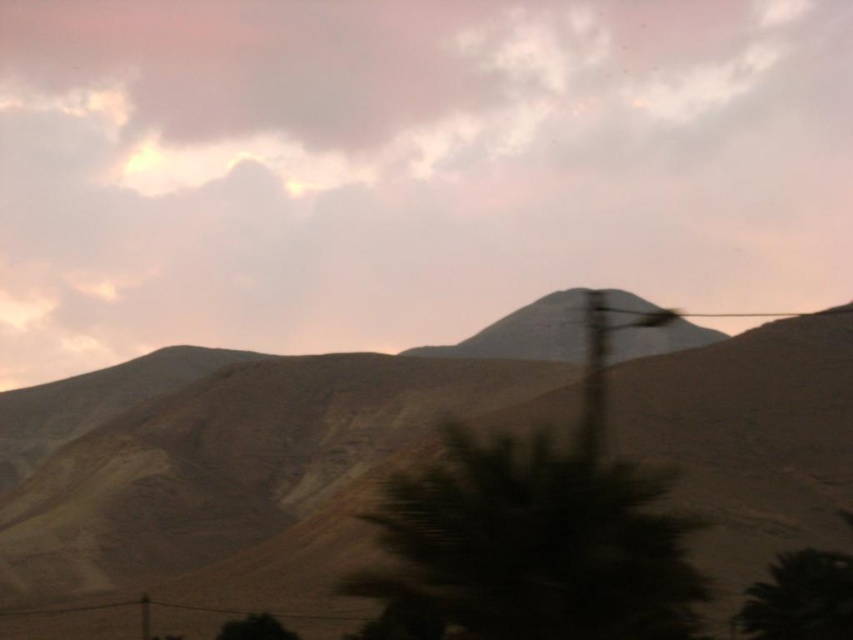
Question: Can you confirm if smokey pink cloud at upper center is positioned above dull brown mountain at center?

Choices:
 (A) no
 (B) yes

Answer: (B)

Question: Is smokey pink cloud at upper center behind dull brown mountain at center?

Choices:
 (A) yes
 (B) no

Answer: (A)

Question: Which object appears farthest from the camera in this image?

Choices:
 (A) smokey pink cloud at upper center
 (B) dull brown mountain at center

Answer: (A)

Question: Is smokey pink cloud at upper center closer to the viewer compared to dull brown mountain at center?

Choices:
 (A) no
 (B) yes

Answer: (A)